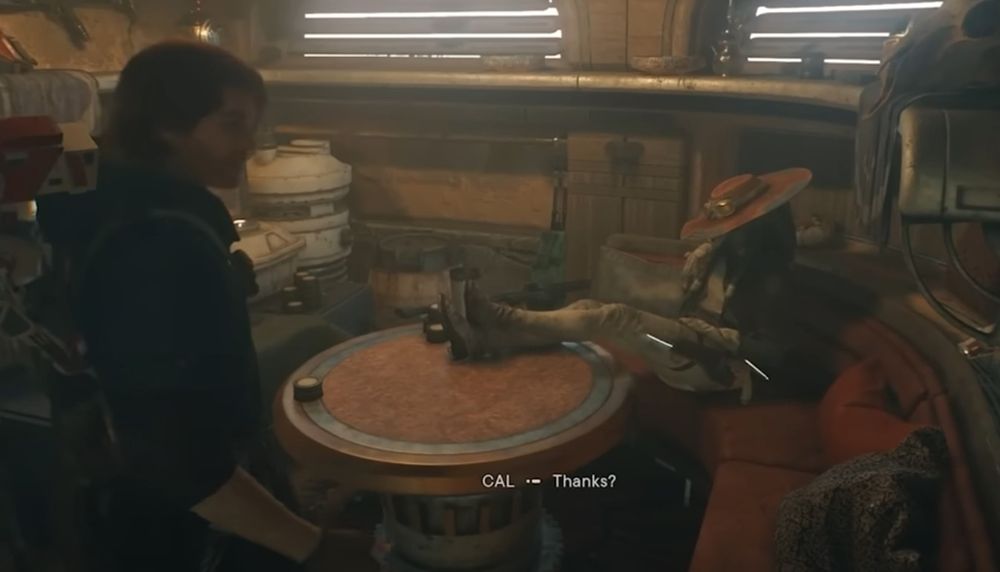
Locate an element on the screen. The width and height of the screenshot is (1000, 572). wall is located at coordinates (106, 47).